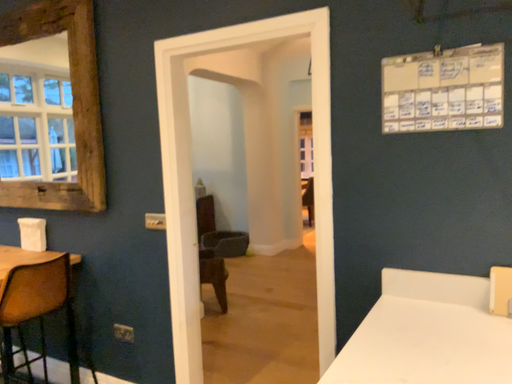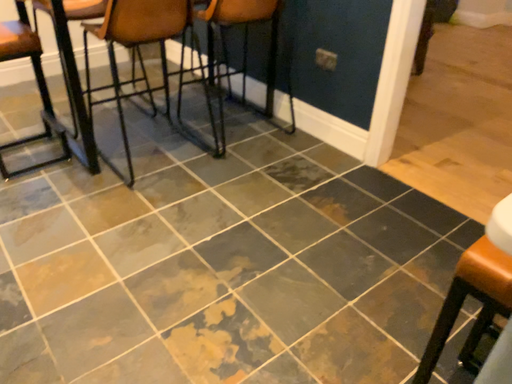
Question: Which way did the camera rotate in the video?

Choices:
 (A) rotated upward
 (B) rotated downward

Answer: (B)